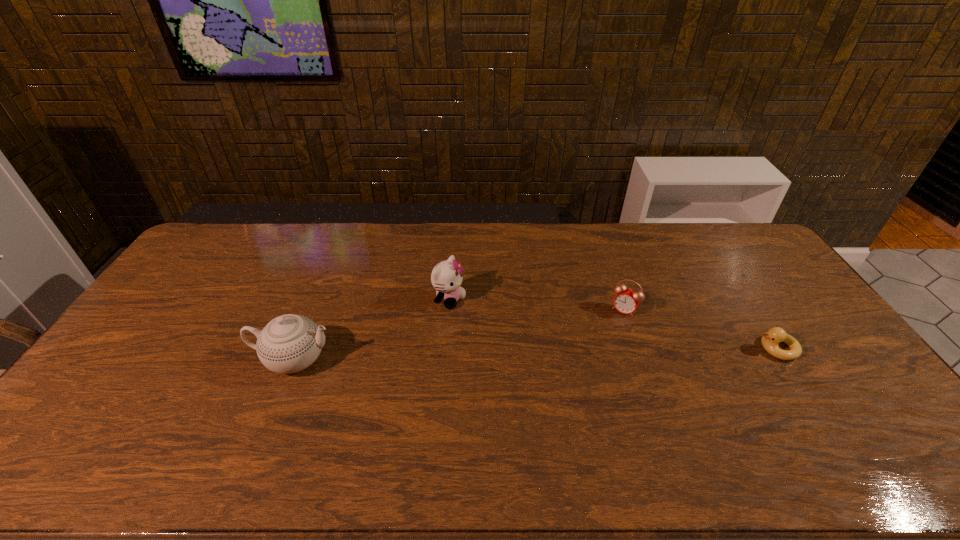
Where is `vacant point located on the front-facing side of the second object from left to right`? vacant point located on the front-facing side of the second object from left to right is located at coordinates (517, 330).

The image size is (960, 540). In order to click on free space located on the front-facing side of the second object from left to right in this screenshot , I will do `click(547, 344)`.

This screenshot has width=960, height=540. Find the location of `free space located on the front-facing side of the second object from left to right`. free space located on the front-facing side of the second object from left to right is located at coordinates (520, 332).

Where is `free space located 0.250m on the clock face of the second object from right to left`? free space located 0.250m on the clock face of the second object from right to left is located at coordinates (585, 370).

This screenshot has width=960, height=540. Identify the location of free spot located 0.230m on the clock face of the second object from right to left. (588, 365).

Image resolution: width=960 pixels, height=540 pixels. Find the location of `vacant space located 0.130m on the clock face of the second object from right to left`. vacant space located 0.130m on the clock face of the second object from right to left is located at coordinates (602, 342).

The image size is (960, 540). I want to click on object present at the right edge, so click(770, 340).

Identify the location of vacant space at the far edge. (720, 261).

In the image, there is a desktop. At what (x,y) coordinates should I click in order to perform the action: click on blank space at the near edge. Please return your answer as a coordinate pair (x, y). Looking at the image, I should click on (548, 411).

Identify the location of vacant space at the right edge of the desktop. Image resolution: width=960 pixels, height=540 pixels. (863, 373).